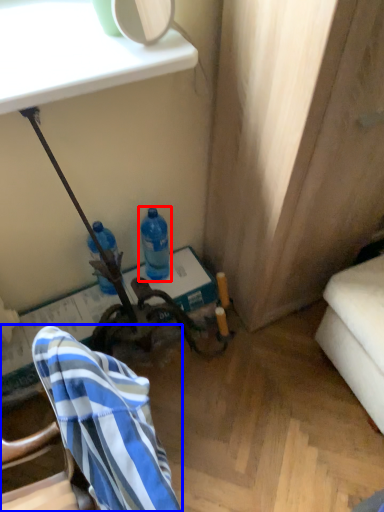
Question: Which object appears closest to the camera in this image, bottle (highlighted by a red box) or chair (highlighted by a blue box)?

Choices:
 (A) bottle
 (B) chair

Answer: (B)